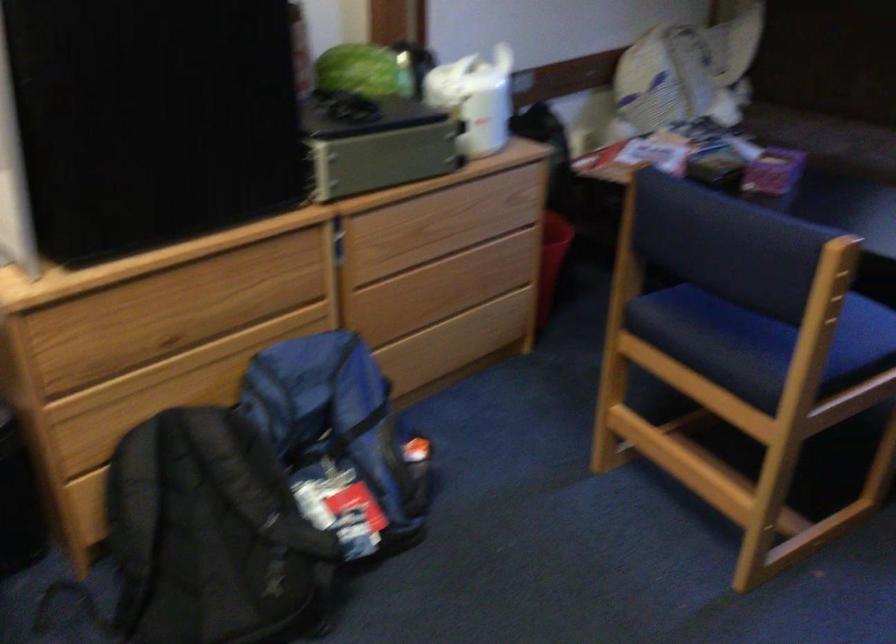
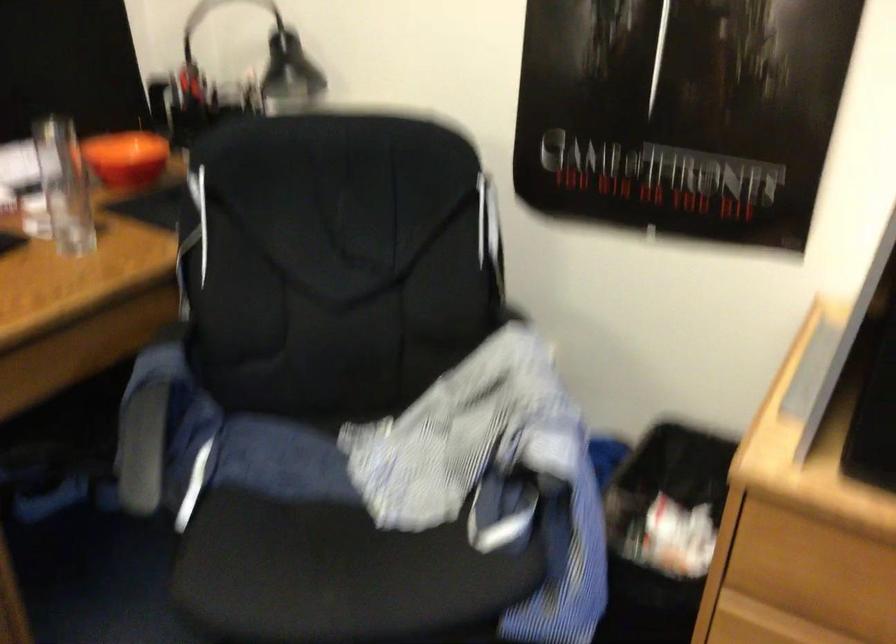
Based on the photo, based on the continuous images, in which direction is the camera rotating?

The rotation direction of the camera is left-down.